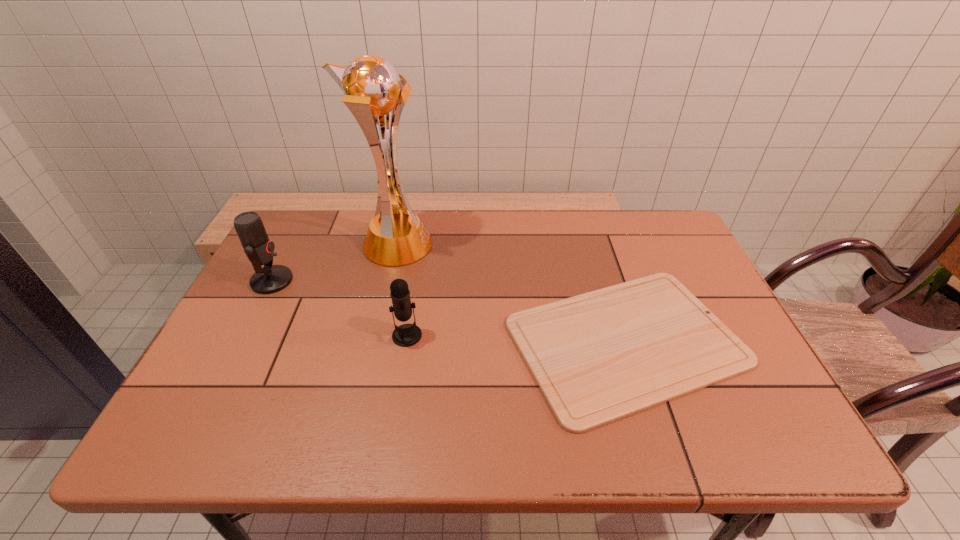
Locate an element on the screen. vacant point located on the left of the chopping board is located at coordinates (370, 341).

This screenshot has height=540, width=960. I want to click on object located in the far edge section of the desktop, so click(372, 88).

You are a GUI agent. You are given a task and a screenshot of the screen. Output one action in this format:
    pyautogui.click(x=<x>, y=<y>)
    Task: Click on the object that is at the near edge
    Image resolution: width=960 pixels, height=540 pixels.
    Given the screenshot: What is the action you would take?
    click(597, 357)

Image resolution: width=960 pixels, height=540 pixels. Identify the location of object that is at the left edge. (259, 249).

The image size is (960, 540). I want to click on object that is at the right edge, so tap(597, 357).

Locate an element on the screen. object located in the near right corner section of the desktop is located at coordinates (597, 357).

Find the location of a particular element. vacant area at the far edge is located at coordinates (531, 248).

I want to click on vacant space at the near edge of the desktop, so click(343, 451).

Where is `vacant region at the left edge of the desktop`? vacant region at the left edge of the desktop is located at coordinates (186, 405).

In the image, there is a desktop. Where is `vacant space at the far left corner`? The image size is (960, 540). vacant space at the far left corner is located at coordinates (307, 232).